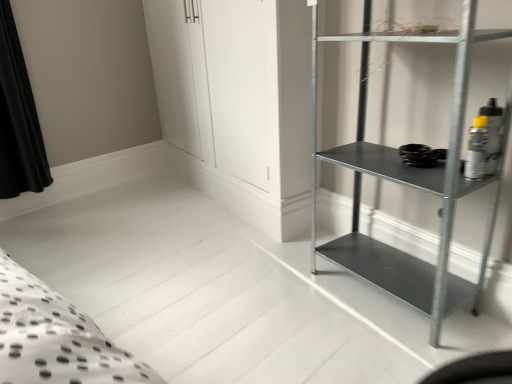
The image size is (512, 384). Describe the element at coordinates (384, 268) in the screenshot. I see `metallic gray shelf at right` at that location.

What is the approximate height of metallic gray shelf at right?

It is 24.07 centimeters.

The height and width of the screenshot is (384, 512). I want to click on metallic gray shelf at right, so click(384, 268).

At what (x,y) coordinates should I click in order to perform the action: click on metallic gray shelf at right. Please return your answer as a coordinate pair (x, y). Looking at the image, I should click on (409, 181).

This screenshot has height=384, width=512. What do you see at coordinates (409, 181) in the screenshot?
I see `metallic gray shelf at right` at bounding box center [409, 181].

This screenshot has width=512, height=384. Find the location of `metallic gray shelf at right`. metallic gray shelf at right is located at coordinates (384, 268).

Is metallic gray shelf at right to the left or to the right of metallic gray shelf at right in the image?

Based on their positions, metallic gray shelf at right is located to the right of metallic gray shelf at right.

Considering their positions, is metallic gray shelf at right located in front of or behind metallic gray shelf at right?

metallic gray shelf at right is positioned farther from the viewer than metallic gray shelf at right.

Which point is more forward, (403, 267) or (470, 22)?

The point (470, 22) is in front.

From the image's perspective, is metallic gray shelf at right below metallic gray shelf at right?

Yes.

From a real-world perspective, between metallic gray shelf at right and metallic gray shelf at right, who is vertically higher?

metallic gray shelf at right.

Looking at their sizes, would you say metallic gray shelf at right is wider or thinner than metallic gray shelf at right?

In the image, metallic gray shelf at right appears to be more narrow than metallic gray shelf at right.

Can you confirm if metallic gray shelf at right is shorter than metallic gray shelf at right?

Yes, metallic gray shelf at right is shorter than metallic gray shelf at right.

Does metallic gray shelf at right have a smaller size compared to metallic gray shelf at right?

Indeed, metallic gray shelf at right has a smaller size compared to metallic gray shelf at right.

Is metallic gray shelf at right situated inside metallic gray shelf at right or outside?

metallic gray shelf at right is outside metallic gray shelf at right.

Is metallic gray shelf at right far away from metallic gray shelf at right?

metallic gray shelf at right is actually quite close to metallic gray shelf at right.

Is metallic gray shelf at right oriented away from metallic gray shelf at right?

No, metallic gray shelf at right is not at the back of metallic gray shelf at right.

How many degrees apart are the facing directions of metallic gray shelf at right and metallic gray shelf at right?

metallic gray shelf at right and metallic gray shelf at right are facing 0.549 degrees away from each other.

You are a GUI agent. You are given a task and a screenshot of the screen. Output one action in this format:
    pyautogui.click(x=<x>, y=<y>)
    Task: Click on the shelf located above the metallic gray shelf at right (from the image's perspective)
    
    Given the screenshot: What is the action you would take?
    pyautogui.click(x=409, y=181)

Between metallic gray shelf at right and metallic gray shelf at right, which one appears on the left side from the viewer's perspective?

metallic gray shelf at right.

Is metallic gray shelf at right positioned behind metallic gray shelf at right?

That is False.

Is point (505, 149) farther from camera compared to point (355, 238)?

No, (505, 149) is in front of (355, 238).

From the image's perspective, which one is positioned higher, metallic gray shelf at right or metallic gray shelf at right?

metallic gray shelf at right is shown above in the image.

From a real-world perspective, is metallic gray shelf at right above or below metallic gray shelf at right?

In terms of real-world spatial position, metallic gray shelf at right is above metallic gray shelf at right.

Considering the sizes of objects metallic gray shelf at right and metallic gray shelf at right in the image provided, who is wider, metallic gray shelf at right or metallic gray shelf at right?

With larger width is metallic gray shelf at right.

Who is taller, metallic gray shelf at right or metallic gray shelf at right?

With more height is metallic gray shelf at right.

Does metallic gray shelf at right have a larger size compared to metallic gray shelf at right?

Yes.

Is metallic gray shelf at right inside or outside of metallic gray shelf at right?

metallic gray shelf at right is located beyond the bounds of metallic gray shelf at right.

Are metallic gray shelf at right and metallic gray shelf at right far apart?

No.

Is metallic gray shelf at right oriented towards metallic gray shelf at right?

No, metallic gray shelf at right is not oriented towards metallic gray shelf at right.

How much distance is there between metallic gray shelf at right and metallic gray shelf at right?

The distance of metallic gray shelf at right from metallic gray shelf at right is 7.73 inches.

Find the location of a particular element. The height and width of the screenshot is (384, 512). shelf that appears above the metallic gray shelf at right (from the image's perspective) is located at coordinates (409, 181).

Where is `cabinet behind the metallic gray shelf at right`? This screenshot has width=512, height=384. cabinet behind the metallic gray shelf at right is located at coordinates (384, 268).

The image size is (512, 384). Find the location of `cabinet below the metallic gray shelf at right (from the image's perspective)`. cabinet below the metallic gray shelf at right (from the image's perspective) is located at coordinates (384, 268).